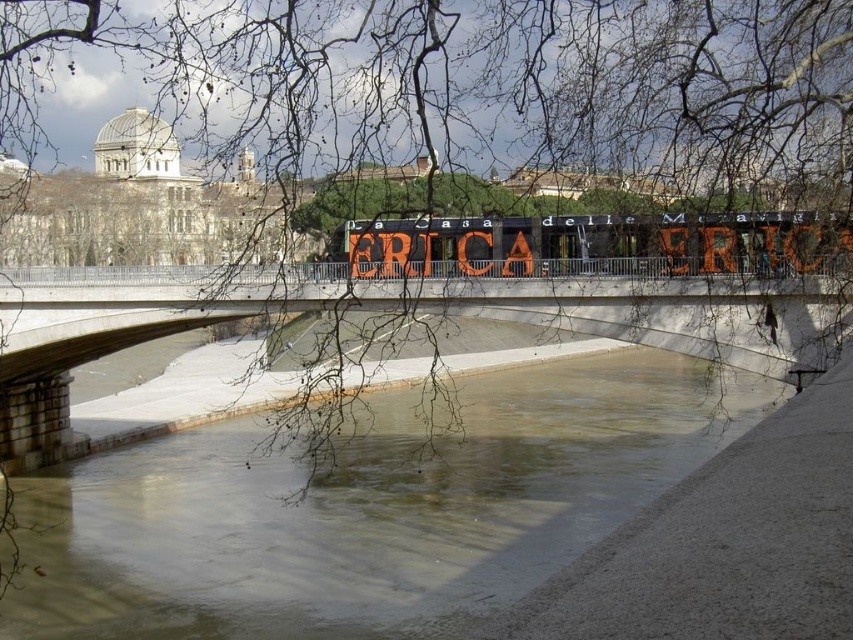
Does concrete bridge at center appear over orange painted sign at center?

Actually, concrete bridge at center is below orange painted sign at center.

The width and height of the screenshot is (853, 640). Find the location of `concrete bridge at center`. concrete bridge at center is located at coordinates (416, 310).

The image size is (853, 640). I want to click on concrete bridge at center, so click(x=416, y=310).

Can you confirm if brown concrete river at center is positioned to the right of orange painted sign at center?

Yes, brown concrete river at center is to the right of orange painted sign at center.

How much distance is there between brown concrete river at center and orange painted sign at center?

The distance of brown concrete river at center from orange painted sign at center is 104.44 feet.

Find the location of `brown concrete river at center`. brown concrete river at center is located at coordinates (367, 508).

Does brown concrete river at center appear on the left side of concrete bridge at center?

No, brown concrete river at center is not to the left of concrete bridge at center.

Who is taller, brown concrete river at center or concrete bridge at center?

Standing taller between the two is brown concrete river at center.

Is point (450, 506) positioned before point (241, 300)?

No, it is behind (241, 300).

The image size is (853, 640). Identify the location of brown concrete river at center. (367, 508).